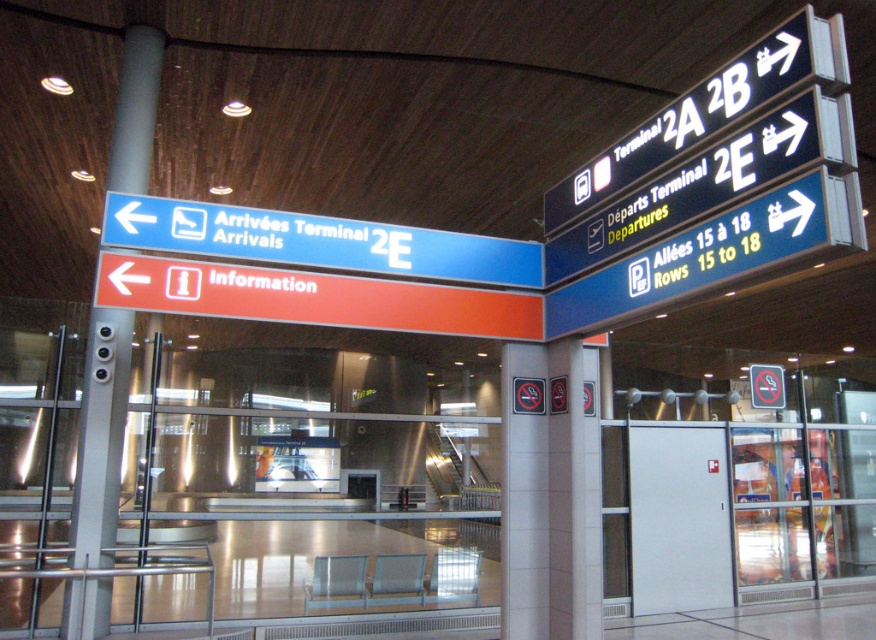
Can you confirm if gray metallic pole at left is positioned to the left of black plastic sign at upper right?

Yes, gray metallic pole at left is to the left of black plastic sign at upper right.

Between gray metallic pole at left and black plastic sign at upper right, which one appears on the right side from the viewer's perspective?

black plastic sign at upper right is more to the right.

Is point (80, 413) behind point (583, 186)?

Yes.

This screenshot has height=640, width=876. What are the coordinates of `gray metallic pole at left` in the screenshot? It's located at (100, 436).

Is blue plastic sign at left bigger than gray metallic pole at left?

Yes, blue plastic sign at left is bigger than gray metallic pole at left.

Between point (173, 209) and point (110, 310), which one is positioned behind?

Positioned behind is point (110, 310).

Where is `blue plastic sign at left`? Image resolution: width=876 pixels, height=640 pixels. blue plastic sign at left is located at coordinates (316, 241).

Can you confirm if blue plastic sign at left is thinner than black plastic sign at upper right?

No.

Who is more distant from viewer, (391, 262) or (822, 48)?

Positioned behind is point (391, 262).

You are a GUI agent. You are given a task and a screenshot of the screen. Output one action in this format:
    pyautogui.click(x=<x>, y=<y>)
    Task: Click on the blue plastic sign at left
    
    Given the screenshot: What is the action you would take?
    pyautogui.click(x=316, y=241)